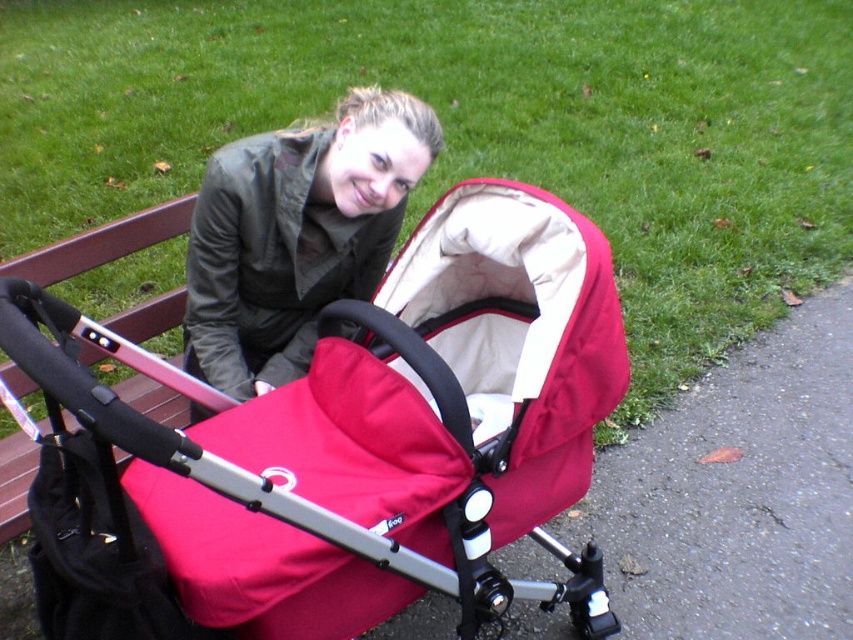
Is the position of matte red baby carriage at center more distant than that of matte green jacket at center?

No, matte red baby carriage at center is closer to the viewer.

This screenshot has width=853, height=640. In order to click on matte red baby carriage at center in this screenshot , I will do `click(338, 445)`.